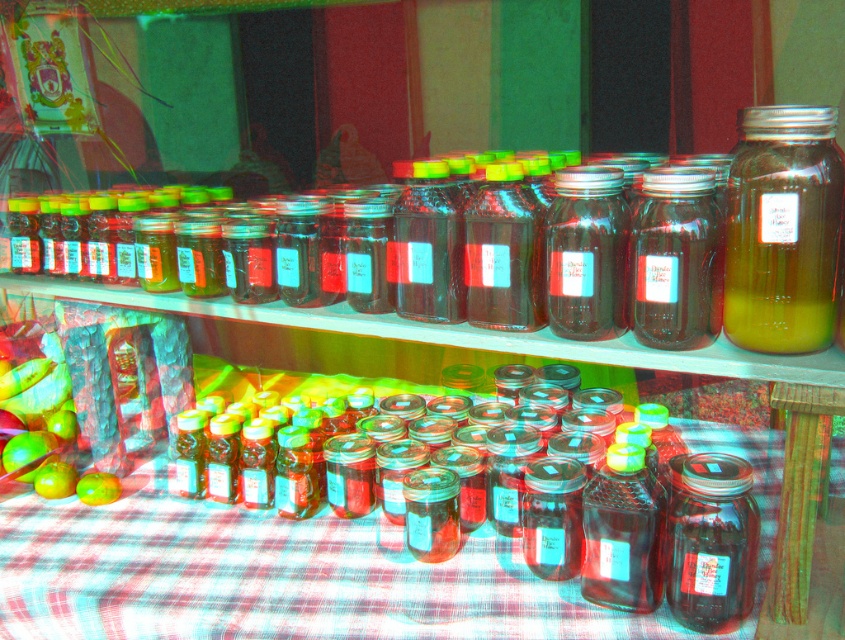
Between clear glass jar at right and green matte apple at lower left, which one has less height?

green matte apple at lower left is shorter.

Does clear glass jar at right come in front of green matte apple at lower left?

Yes, clear glass jar at right is in front of green matte apple at lower left.

Does point (792, 176) come in front of point (102, 480)?

Yes, point (792, 176) is closer to viewer.

Locate an element on the screen. The height and width of the screenshot is (640, 845). clear glass jar at right is located at coordinates (782, 228).

Does transparent glass jars at center have a greater height compared to clear glass jar at right?

No, transparent glass jars at center is not taller than clear glass jar at right.

In the scene shown: How far apart are transparent glass jars at center and clear glass jar at right?

They are 21.66 inches apart.

The image size is (845, 640). In order to click on transparent glass jars at center in this screenshot , I will do pos(341,580).

Can you confirm if transparent glass jars at center is positioned above transparent glass jar at lower right?

No.

Is transparent glass jars at center shorter than transparent glass jar at lower right?

Yes, transparent glass jars at center is shorter than transparent glass jar at lower right.

At what (x,y) coordinates should I click in order to perform the action: click on transparent glass jars at center. Please return your answer as a coordinate pair (x, y). Image resolution: width=845 pixels, height=640 pixels. Looking at the image, I should click on (341, 580).